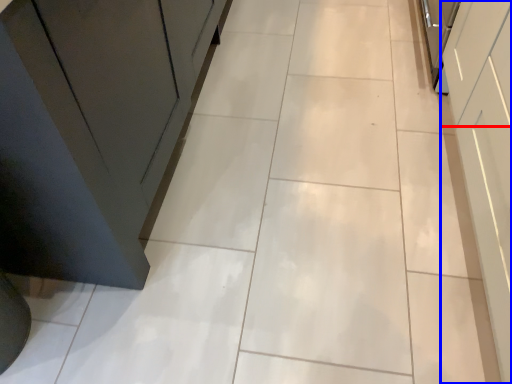
Question: Which of the following is the farthest to the observer, drawer (highlighted by a red box) or cabinetry (highlighted by a blue box)?

Choices:
 (A) drawer
 (B) cabinetry

Answer: (A)